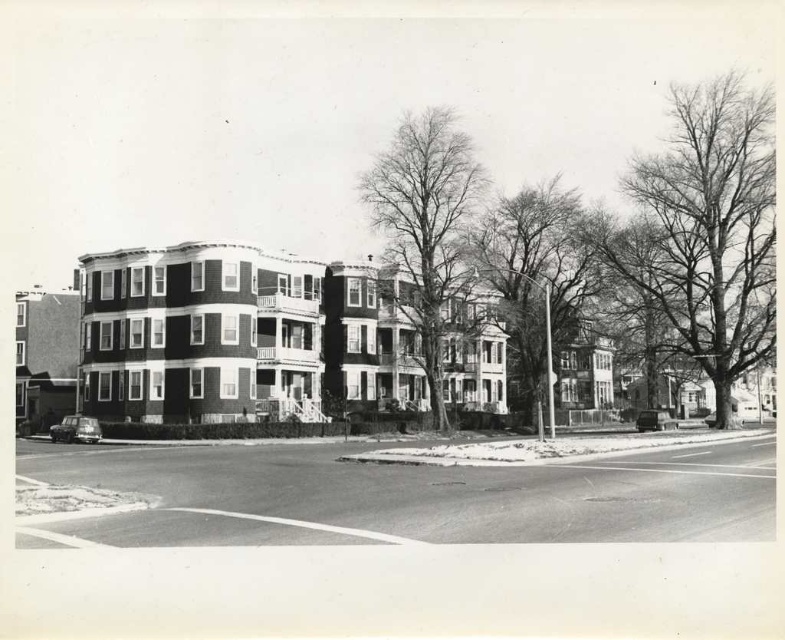
Question: Which object appears closest to the camera in this image?

Choices:
 (A) smooth bark tree at center
 (B) bare wood tree at center

Answer: (A)

Question: Does bare branches at upper right appear over bare wood tree at center?

Choices:
 (A) yes
 (B) no

Answer: (A)

Question: Is bare wood tree at center to the left of smooth bark tree at center from the viewer's perspective?

Choices:
 (A) no
 (B) yes

Answer: (B)

Question: Among these points, which one is farthest from the camera?

Choices:
 (A) (563, 282)
 (B) (745, 212)

Answer: (A)

Question: Does bare branches at upper right have a larger size compared to smooth bark tree at center?

Choices:
 (A) yes
 (B) no

Answer: (A)

Question: Which is farther from the bare branches at upper right?

Choices:
 (A) smooth bark tree at center
 (B) bare wood tree at center

Answer: (B)